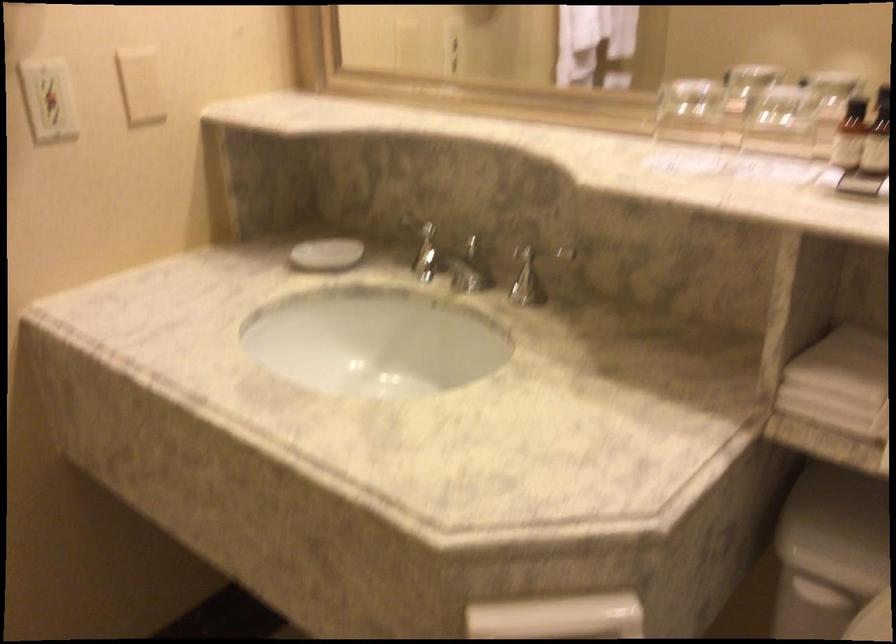
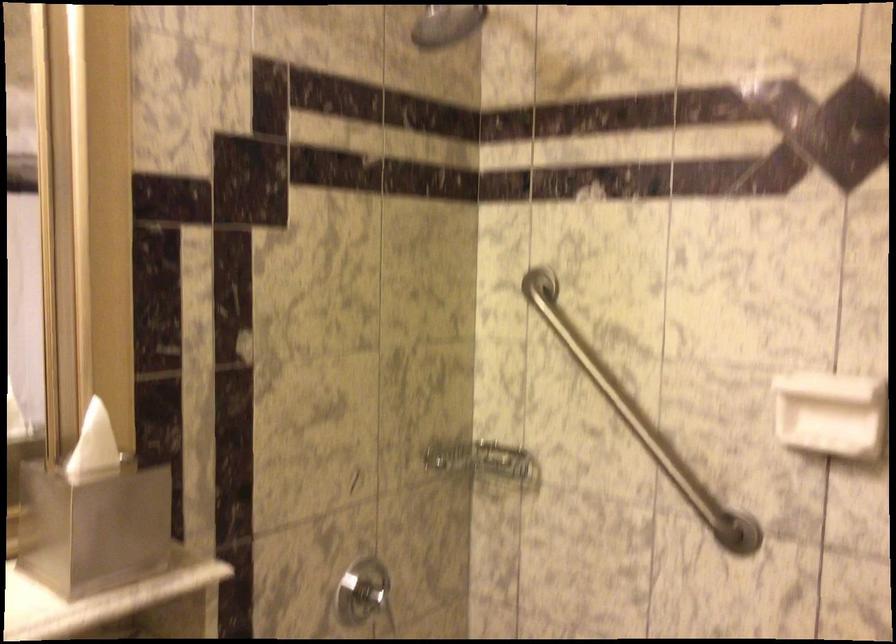
Question: The images are taken continuously from a first-person perspective. In which direction is your viewpoint rotating?

Choices:
 (A) Left
 (B) Right
 (C) Up
 (D) Down

Answer: (B)